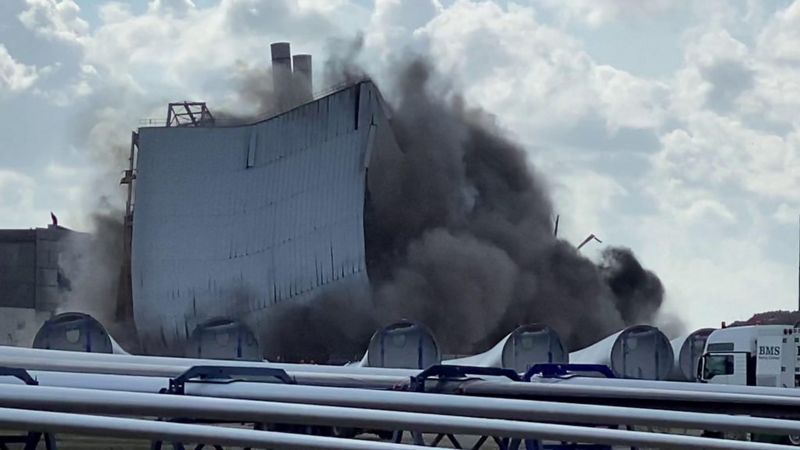
Locate an element on the screen. glass is located at coordinates (638, 360).